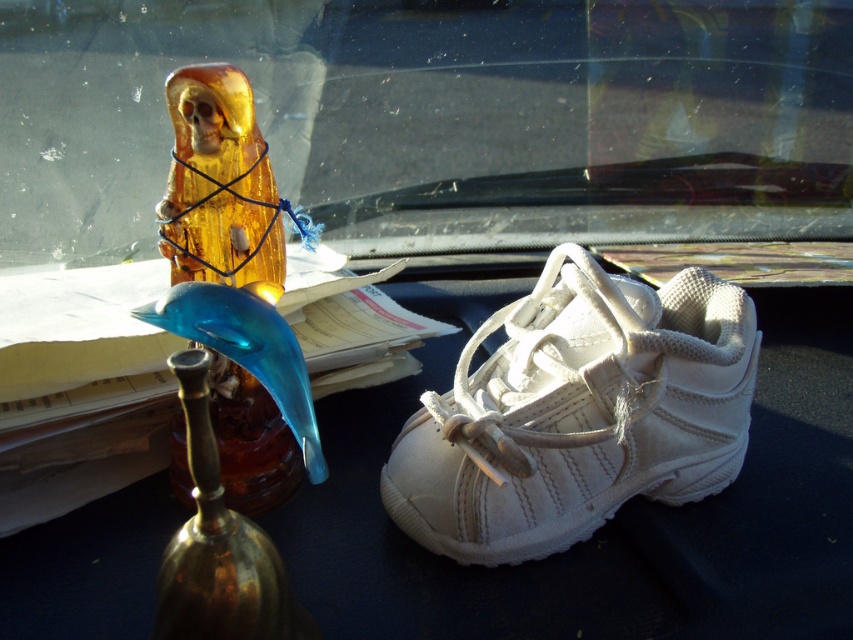
Question: Which point is farther from the camera taking this photo?

Choices:
 (A) (401, 166)
 (B) (265, 188)

Answer: (A)

Question: Is white suede running shoe at center above translucent amber statue at left?

Choices:
 (A) no
 (B) yes

Answer: (A)

Question: Can you confirm if transparent glass windshield at upper center is positioned above white suede running shoe at center?

Choices:
 (A) yes
 (B) no

Answer: (A)

Question: Considering the real-world distances, which object is closest to the translucent amber statue at left?

Choices:
 (A) white suede running shoe at center
 (B) transparent glass windshield at upper center

Answer: (A)

Question: Can you confirm if white suede running shoe at center is positioned below translucent amber statue at left?

Choices:
 (A) yes
 (B) no

Answer: (A)

Question: Among these objects, which one is farthest from the camera?

Choices:
 (A) transparent glass windshield at upper center
 (B) white suede running shoe at center

Answer: (A)